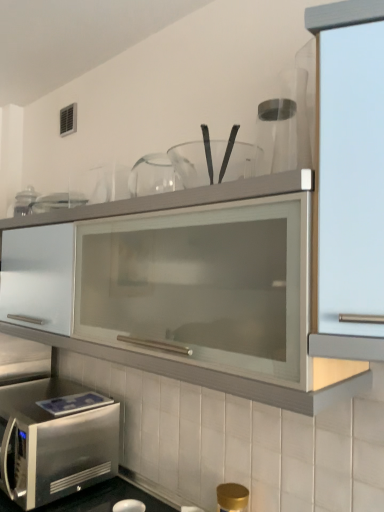
Question: Is transparent glass jar at upper center to the left of stainless steel microwave at lower left from the viewer's perspective?

Choices:
 (A) no
 (B) yes

Answer: (A)

Question: Is transparent glass jar at upper center facing towards stainless steel microwave at lower left?

Choices:
 (A) yes
 (B) no

Answer: (B)

Question: Is transparent glass jar at upper center further to the viewer compared to stainless steel microwave at lower left?

Choices:
 (A) no
 (B) yes

Answer: (A)

Question: Is transparent glass jar at upper center to the right of stainless steel microwave at lower left from the viewer's perspective?

Choices:
 (A) yes
 (B) no

Answer: (A)

Question: Can you confirm if transparent glass jar at upper center is wider than stainless steel microwave at lower left?

Choices:
 (A) no
 (B) yes

Answer: (A)

Question: Is the surface of transparent glass jar at upper center in direct contact with stainless steel microwave at lower left?

Choices:
 (A) no
 (B) yes

Answer: (A)

Question: Is stainless steel microwave at lower left turned away from transparent glass jar at upper center?

Choices:
 (A) yes
 (B) no

Answer: (B)

Question: Can you confirm if stainless steel microwave at lower left is thinner than transparent glass jar at upper center?

Choices:
 (A) no
 (B) yes

Answer: (A)

Question: Is stainless steel microwave at lower left not inside transparent glass jar at upper center?

Choices:
 (A) no
 (B) yes

Answer: (B)

Question: Is stainless steel microwave at lower left wider than transparent glass jar at upper center?

Choices:
 (A) no
 (B) yes

Answer: (B)

Question: Is stainless steel microwave at lower left smaller than transparent glass jar at upper center?

Choices:
 (A) no
 (B) yes

Answer: (A)

Question: From a real-world perspective, is stainless steel microwave at lower left beneath transparent glass jar at upper center?

Choices:
 (A) yes
 (B) no

Answer: (A)

Question: Is stainless steel microwave at lower left completely or partially outside of satin glass cabinet at right?

Choices:
 (A) yes
 (B) no

Answer: (A)